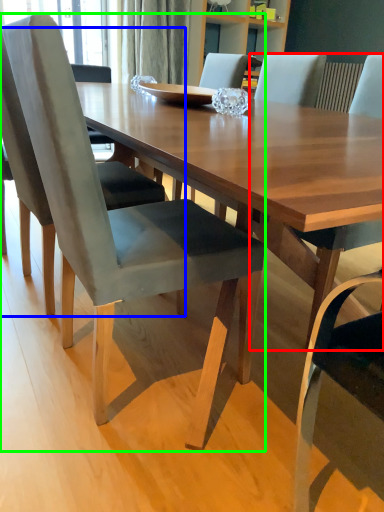
Question: Which is nearer to the chair (highlighted by a red box)? chair (highlighted by a blue box) or chair (highlighted by a green box).

Choices:
 (A) chair
 (B) chair

Answer: (B)